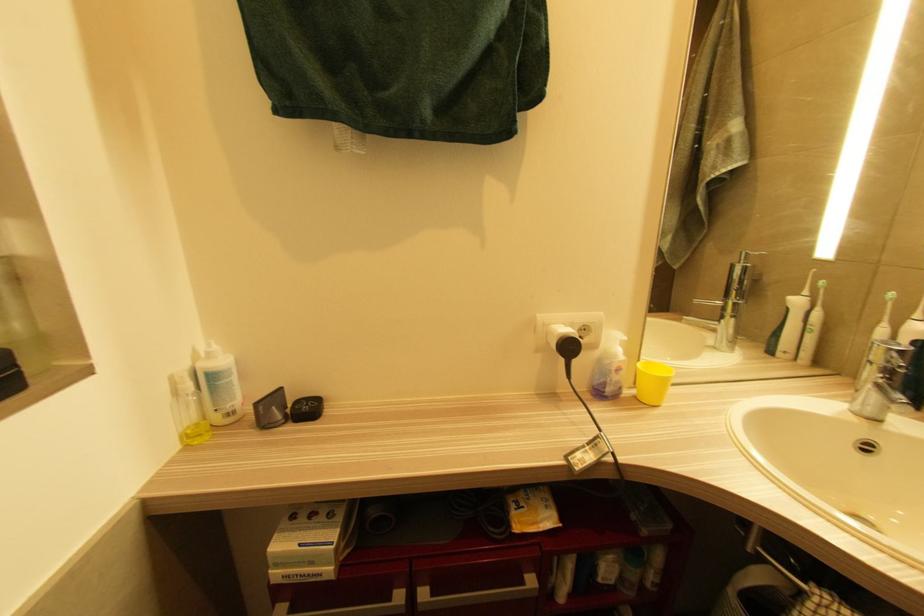
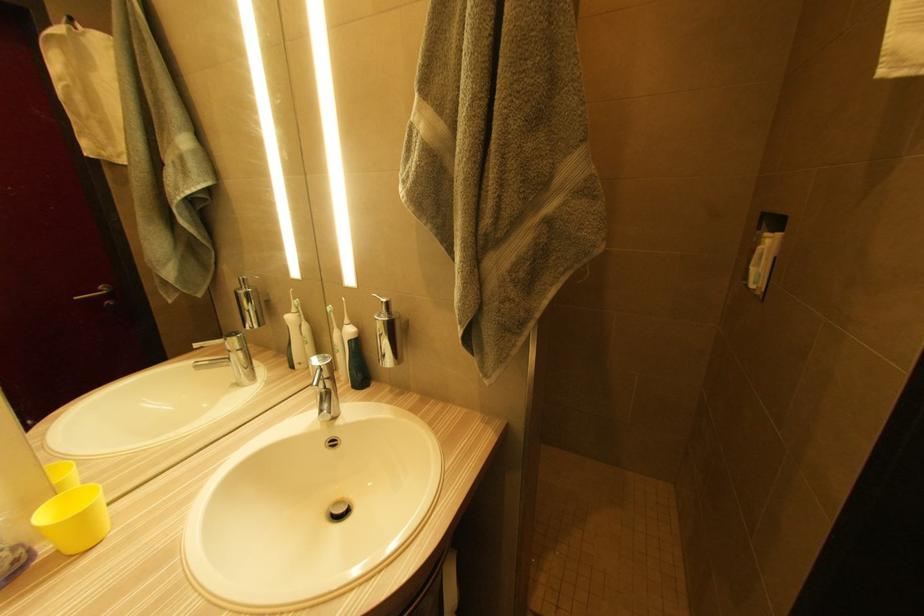
Question: The images are taken continuously from a first-person perspective. In which direction is your viewpoint rotating?

Choices:
 (A) Left
 (B) Right
 (C) Up
 (D) Down

Answer: (B)